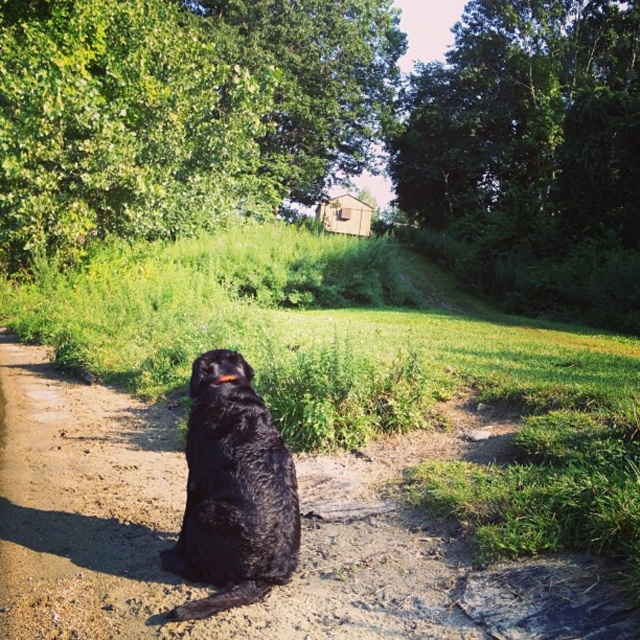
You are standing at the edge of the dirt track at center and want to approach the shiny black fur at center. In which direction should you move to reach it?

The shiny black fur at center is to the left of the dirt track at center, so you should move to the left to reach it.

You are a hiker trying to decide whether to walk along the dirt track at center or the shiny black fur at center. Which path is narrower?

The dirt track at center is thinner than the shiny black fur at center, so the dirt track at center is narrower.